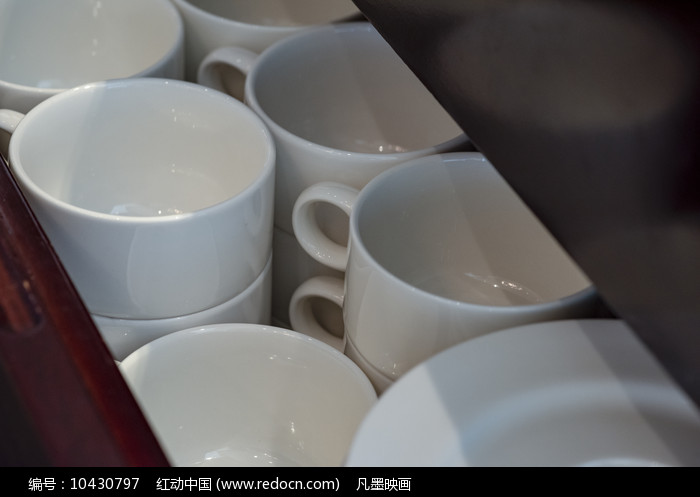
Identify the location of coffee cups. (134, 25), (266, 6), (150, 145), (368, 91), (251, 302), (294, 261), (414, 319), (379, 381), (281, 378), (427, 404).